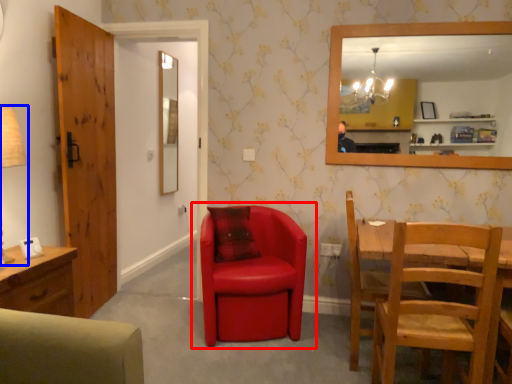
Question: Which of the following is the closest to the observer, chair (highlighted by a red box) or table lamp (highlighted by a blue box)?

Choices:
 (A) chair
 (B) table lamp

Answer: (B)